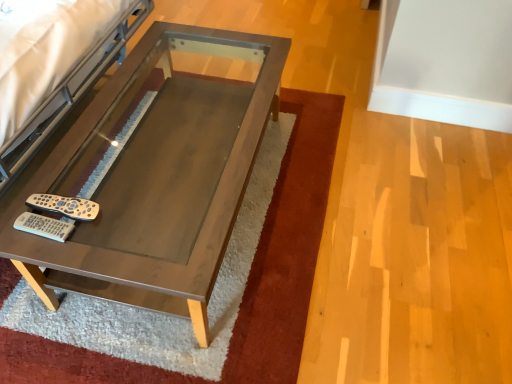
Question: From a real-world perspective, is silver metallic remote at lower left positioned above or below matte wood table at center?

Choices:
 (A) below
 (B) above

Answer: (B)

Question: Does point (31, 195) appear closer or farther from the camera than point (217, 41)?

Choices:
 (A) farther
 (B) closer

Answer: (B)

Question: In the image, is silver metallic remote at lower left on the left side or the right side of matte wood table at center?

Choices:
 (A) right
 (B) left

Answer: (B)

Question: Which is correct: matte wood table at center is inside silver metallic remote at lower left, or outside of it?

Choices:
 (A) inside
 (B) outside

Answer: (B)

Question: In the image, is matte wood table at center positioned in front of or behind silver metallic remote at lower left?

Choices:
 (A) behind
 (B) front

Answer: (B)

Question: Considering the positions of matte wood table at center and silver metallic remote at lower left in the image, is matte wood table at center bigger or smaller than silver metallic remote at lower left?

Choices:
 (A) big
 (B) small

Answer: (A)

Question: In terms of width, does matte wood table at center look wider or thinner when compared to silver metallic remote at lower left?

Choices:
 (A) wide
 (B) thin

Answer: (A)